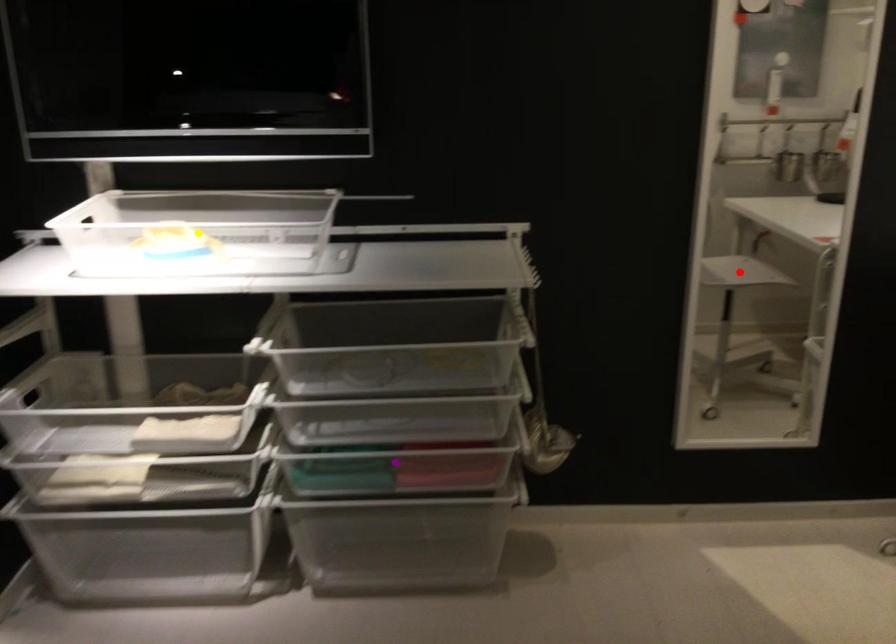
Order these from farthest to nearest:
purple point
yellow point
red point

red point → purple point → yellow point